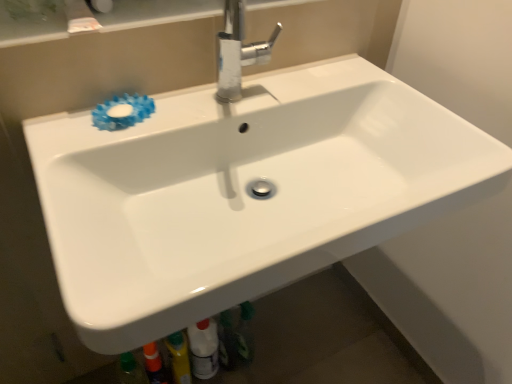
Question: From a real-world perspective, does polished chrome faucet at upper center sit lower than blue rubber flower at upper left?

Choices:
 (A) yes
 (B) no

Answer: (B)

Question: Can you confirm if polished chrome faucet at upper center is wider than blue rubber flower at upper left?

Choices:
 (A) no
 (B) yes

Answer: (B)

Question: Is polished chrome faucet at upper center smaller than blue rubber flower at upper left?

Choices:
 (A) no
 (B) yes

Answer: (A)

Question: Is polished chrome faucet at upper center looking in the opposite direction of blue rubber flower at upper left?

Choices:
 (A) yes
 (B) no

Answer: (B)

Question: From a real-world perspective, is polished chrome faucet at upper center over blue rubber flower at upper left?

Choices:
 (A) no
 (B) yes

Answer: (B)

Question: From the image's perspective, is polished chrome faucet at upper center on top of blue rubber flower at upper left?

Choices:
 (A) yes
 (B) no

Answer: (A)

Question: From a real-world perspective, is white glossy bottle at lower center over polished chrome faucet at upper center?

Choices:
 (A) yes
 (B) no

Answer: (B)

Question: Is white glossy bottle at lower center wider than polished chrome faucet at upper center?

Choices:
 (A) no
 (B) yes

Answer: (A)

Question: Can we say white glossy bottle at lower center lies outside polished chrome faucet at upper center?

Choices:
 (A) no
 (B) yes

Answer: (B)

Question: Considering the relative sizes of white glossy bottle at lower center and polished chrome faucet at upper center in the image provided, is white glossy bottle at lower center smaller than polished chrome faucet at upper center?

Choices:
 (A) yes
 (B) no

Answer: (A)

Question: Can you confirm if white glossy bottle at lower center is bigger than polished chrome faucet at upper center?

Choices:
 (A) yes
 (B) no

Answer: (B)

Question: Can you confirm if white glossy bottle at lower center is positioned to the right of polished chrome faucet at upper center?

Choices:
 (A) no
 (B) yes

Answer: (A)

Question: Is blue rubber flower at upper left outside white glossy bottle at lower center?

Choices:
 (A) no
 (B) yes

Answer: (B)